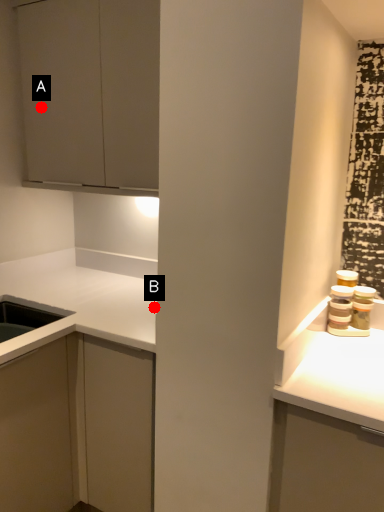
Question: Two points are circled on the image, labeled by A and B beside each circle. Which of the following is the closest to the observer?

Choices:
 (A) A is closer
 (B) B is closer

Answer: (B)